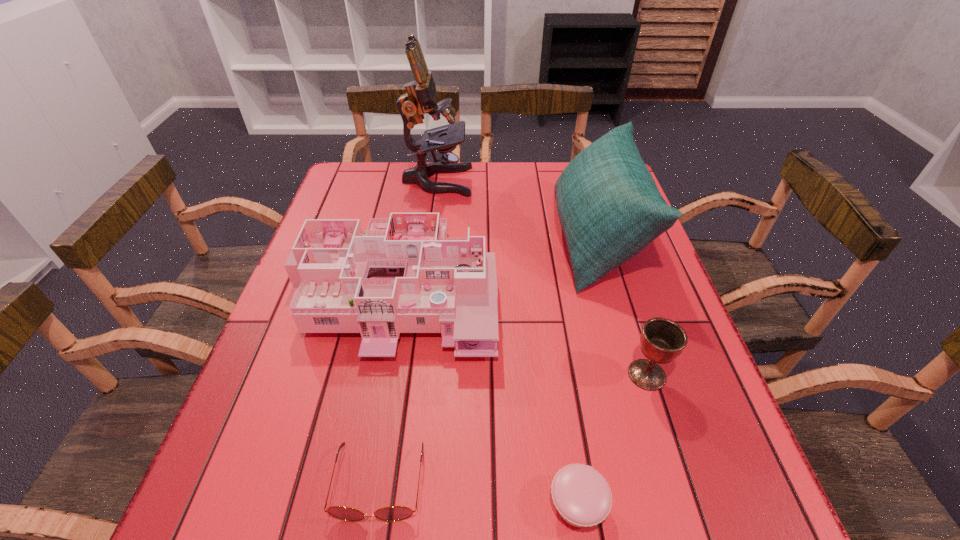
Locate an element on the screen. The width and height of the screenshot is (960, 540). microscope is located at coordinates (420, 98).

I want to click on the second tallest object, so click(609, 206).

The height and width of the screenshot is (540, 960). I want to click on dollhouse, so click(408, 275).

Identify the location of chalice. (662, 340).

Find the location of a particular element. This screenshot has height=540, width=960. sunglasses is located at coordinates (393, 513).

Locate an element on the screen. cupcake is located at coordinates [x=583, y=498].

You are a GUI agent. You are given a task and a screenshot of the screen. Output one action in this format:
    pyautogui.click(x=<x>, y=<y>)
    Task: Click on the free space located 0.070m at the eyepieces of the tallest object
    
    Given the screenshot: What is the action you would take?
    pyautogui.click(x=493, y=181)

Where is `free space located 0.330m on the front-facing side of the second tallest object`? The width and height of the screenshot is (960, 540). free space located 0.330m on the front-facing side of the second tallest object is located at coordinates (431, 238).

The image size is (960, 540). Find the location of `free location located 0.180m on the front-facing side of the second tallest object`. free location located 0.180m on the front-facing side of the second tallest object is located at coordinates (487, 238).

Identify the location of vacant space located on the front-facing side of the second tallest object. The height and width of the screenshot is (540, 960). (409, 238).